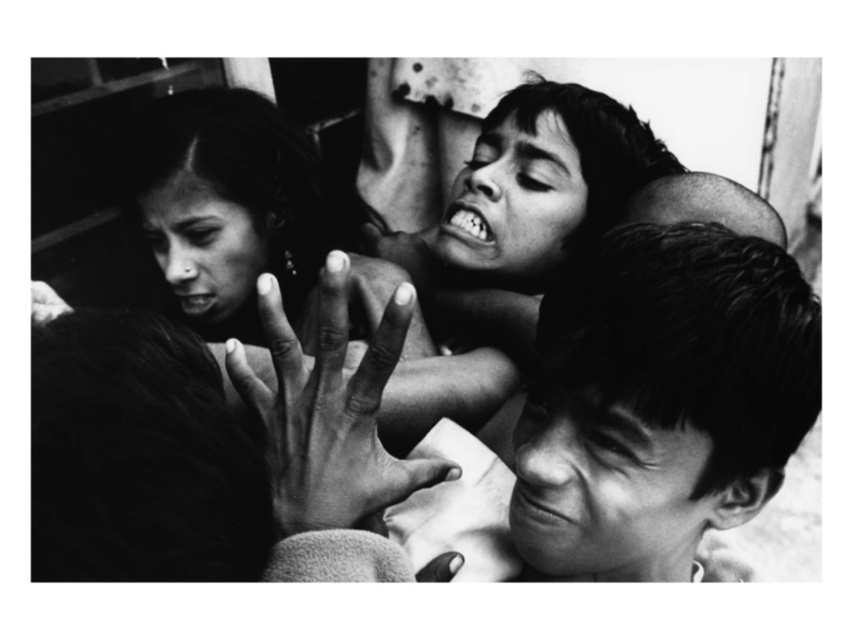
Question: Can you confirm if smooth skin hand at center is wider than smooth skin hand at lower left?

Choices:
 (A) no
 (B) yes

Answer: (A)

Question: Can you confirm if smooth skin face at center is bigger than smooth skin hand at lower left?

Choices:
 (A) no
 (B) yes

Answer: (B)

Question: Which object is the closest to the smooth skin face at center?

Choices:
 (A) smooth skin hand at center
 (B) smooth skin hand at lower left

Answer: (A)

Question: In this image, where is smooth skin face at center located relative to smooth skin hand at lower left?

Choices:
 (A) left
 (B) right

Answer: (B)

Question: Which is nearer to the smooth skin face at center?

Choices:
 (A) smooth skin hand at center
 (B) smooth skin hand at lower left

Answer: (A)

Question: Which point appears closest to the camera in this image?

Choices:
 (A) (370, 448)
 (B) (32, 298)
 (C) (596, 307)

Answer: (C)